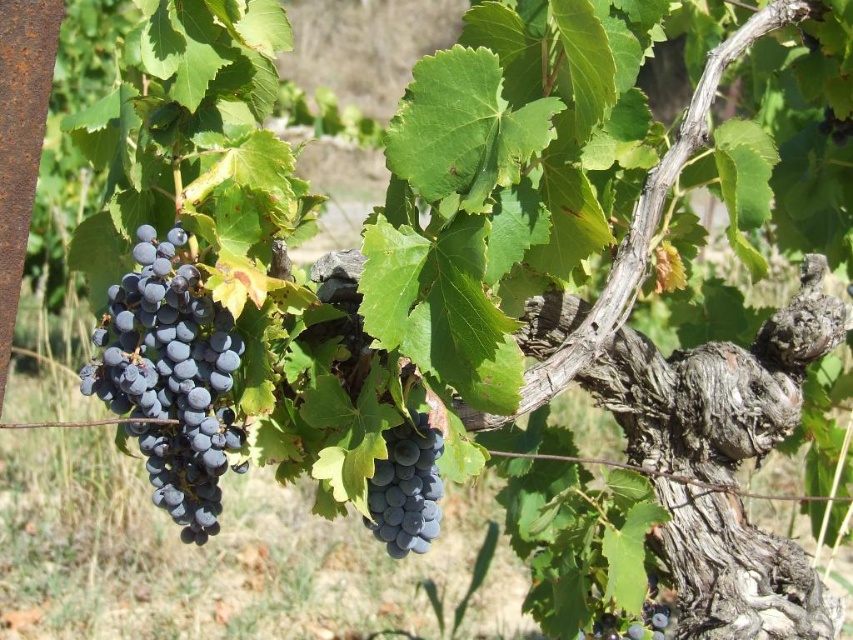
You are a fruit picker observing a grapevine. You see the shiny dark blue grapes at center and the dark purple grapes at lower right. Which cluster is positioned higher up on the grapevine?

The shiny dark blue grapes at center is taller than dark purple grapes at lower right, so the shiny dark blue grapes at center is positioned higher up on the grapevine.

You are an artist sketching the grapevine and want to capture the depth between the shiny dark blue grapes at center and the dark purple grapes at lower right. Which grapes should you draw first to create a sense of depth?

You should draw the dark purple grapes at lower right first because they are farther away from the viewer than the shiny dark blue grapes at center, allowing you to layer them appropriately for depth.

You are a fruit vendor inspecting two clusters of grapes in the image. The first cluster is the dark purple grapes at left, and the second is the dark purple grapes at lower right. Which cluster has a larger width?

The dark purple grapes at left might be wider than dark purple grapes at lower right.